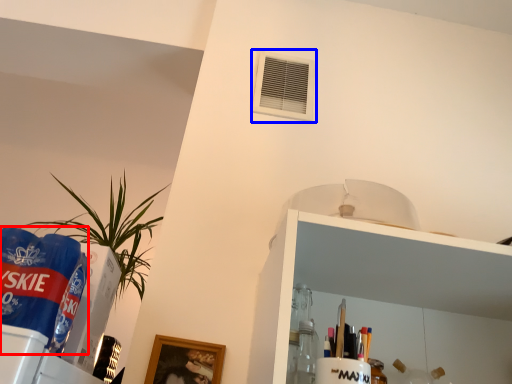
Question: Which object is closer to the camera taking this photo, beverage (highlighted by a red box) or air conditioning (highlighted by a blue box)?

Choices:
 (A) beverage
 (B) air conditioning

Answer: (A)